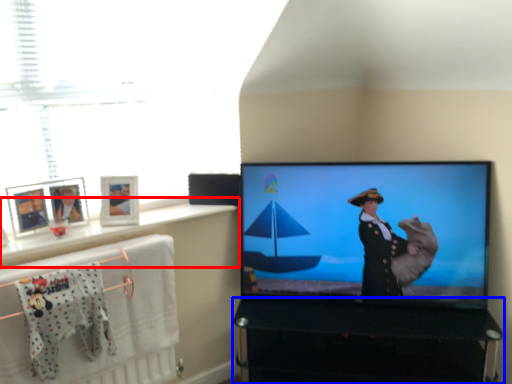
Question: Which of the following is the farthest to the observer, window sill (highlighted by a red box) or furniture (highlighted by a blue box)?

Choices:
 (A) window sill
 (B) furniture

Answer: (B)